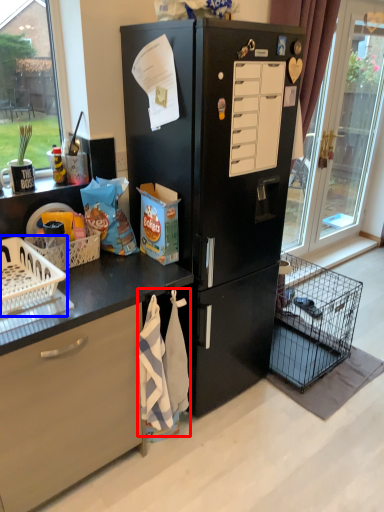
Question: Which object is closer to the camera taking this photo, material (highlighted by a red box) or basket (highlighted by a blue box)?

Choices:
 (A) material
 (B) basket

Answer: (B)